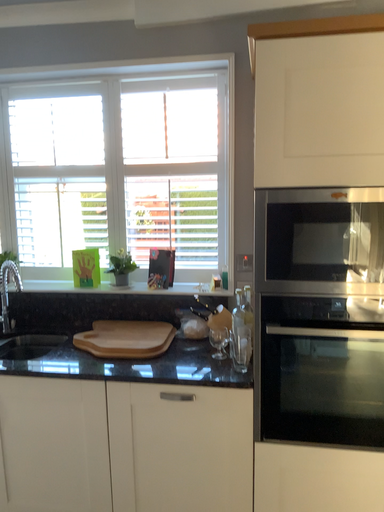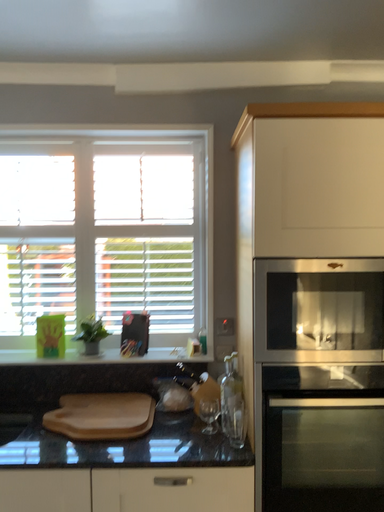
Question: How did the camera likely rotate when shooting the video?

Choices:
 (A) rotated left
 (B) rotated right

Answer: (B)